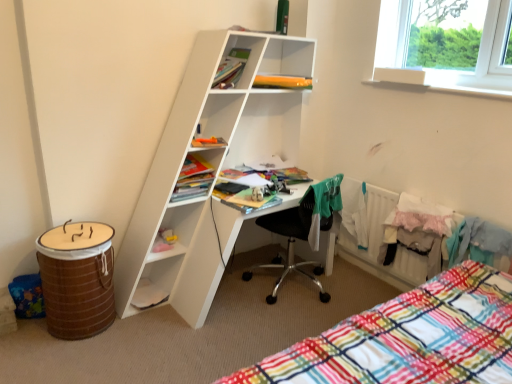
Question: From the image's perspective, is white plastic radiator at lower right beneath matte green book at upper center, which is the 1th book from top to bottom?

Choices:
 (A) yes
 (B) no

Answer: (A)

Question: Can you confirm if white plastic radiator at lower right is thinner than matte green book at upper center, which is the 1th book from top to bottom?

Choices:
 (A) yes
 (B) no

Answer: (A)

Question: Is white plastic radiator at lower right touching matte green book at upper center, which is the 1th book from top to bottom?

Choices:
 (A) yes
 (B) no

Answer: (B)

Question: Is white plastic radiator at lower right oriented away from matte green book at upper center, which is the fifth book from bottom to top?

Choices:
 (A) yes
 (B) no

Answer: (B)

Question: Can matte green book at upper center, which is the fifth book from bottom to top, be found inside white plastic radiator at lower right?

Choices:
 (A) no
 (B) yes

Answer: (A)

Question: Considering the relative positions of matte green book at upper center, which is the 1th book from top to bottom, and orange plastic bag at upper center, arranged as the second book when viewed from the top, in the image provided, is matte green book at upper center, which is the 1th book from top to bottom, to the left or to the right of orange plastic bag at upper center, arranged as the second book when viewed from the top,?

Choices:
 (A) left
 (B) right

Answer: (A)

Question: Is point (245, 57) positioned closer to the camera than point (254, 77)?

Choices:
 (A) closer
 (B) farther

Answer: (B)

Question: Considering the positions of matte green book at upper center, which is the fifth book from bottom to top, and orange plastic bag at upper center, arranged as the second book when viewed from the top, in the image, is matte green book at upper center, which is the fifth book from bottom to top, wider or thinner than orange plastic bag at upper center, arranged as the second book when viewed from the top,?

Choices:
 (A) wide
 (B) thin

Answer: (B)

Question: Is matte green book at upper center, which is the 1th book from top to bottom, bigger or smaller than orange plastic bag at upper center, which ranks as the 4th book in bottom-to-top order?

Choices:
 (A) small
 (B) big

Answer: (B)

Question: In the image, is orange plastic bag at upper center, arranged as the second book when viewed from the top, positioned in front of or behind white matte book at lower left, which appears as the 1th book when ordered from the bottom?

Choices:
 (A) behind
 (B) front

Answer: (A)

Question: Which is correct: orange plastic bag at upper center, arranged as the second book when viewed from the top, is inside white matte book at lower left, the fifth book positioned from the top, or outside of it?

Choices:
 (A) outside
 (B) inside

Answer: (A)

Question: Looking at their shapes, would you say orange plastic bag at upper center, arranged as the second book when viewed from the top, is wider or thinner than white matte book at lower left, the fifth book positioned from the top?

Choices:
 (A) wide
 (B) thin

Answer: (A)

Question: From the image's perspective, is orange plastic bag at upper center, arranged as the second book when viewed from the top, above or below white matte book at lower left, which appears as the 1th book when ordered from the bottom?

Choices:
 (A) above
 (B) below

Answer: (A)

Question: Is orange plastic bag at upper center, which ranks as the 4th book in bottom-to-top order, taller or shorter than white matte desk at center?

Choices:
 (A) short
 (B) tall

Answer: (A)

Question: Does point 279,84 appear closer or farther from the camera than point 231,162?

Choices:
 (A) closer
 (B) farther

Answer: (A)